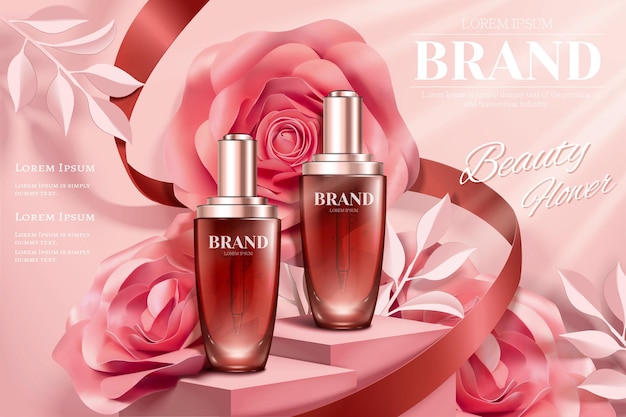
In order to click on bottle in this screenshot , I will do `click(265, 327)`.